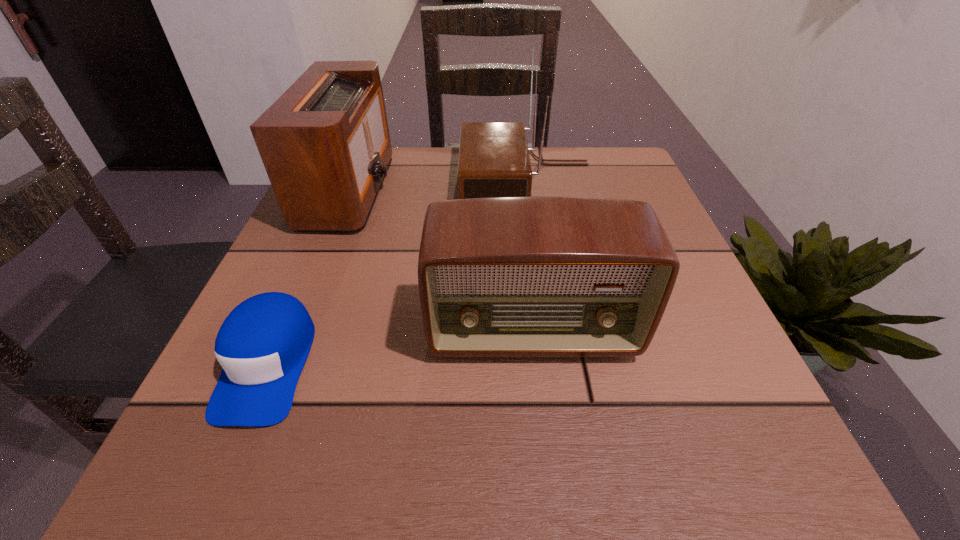
Locate an element on the screen. The image size is (960, 540). the leftmost radio receiver is located at coordinates (325, 144).

I want to click on the nearest radio receiver, so click(502, 276).

At what (x,y) coordinates should I click in order to perform the action: click on the shortest object. Please return your answer as a coordinate pair (x, y). This screenshot has width=960, height=540. Looking at the image, I should click on (262, 345).

You are a GUI agent. You are given a task and a screenshot of the screen. Output one action in this format:
    pyautogui.click(x=<x>, y=<y>)
    Task: Click on the vacant space located on the right of the leftmost radio receiver
    Image resolution: width=960 pixels, height=540 pixels.
    Given the screenshot: What is the action you would take?
    pyautogui.click(x=525, y=190)

The image size is (960, 540). In order to click on free space located 0.090m on the front-facing side of the nearest radio receiver in this screenshot , I will do `click(542, 423)`.

The image size is (960, 540). I want to click on vacant space located 0.060m on the front-facing side of the shortest object, so (220, 477).

At what (x,y) coordinates should I click in order to perform the action: click on object that is at the near edge. Please return your answer as a coordinate pair (x, y). The height and width of the screenshot is (540, 960). Looking at the image, I should click on (262, 345).

The width and height of the screenshot is (960, 540). I want to click on radio receiver located in the left edge section of the desktop, so click(325, 144).

Find the location of a particular element. This screenshot has width=960, height=540. baseball cap at the left edge is located at coordinates (262, 345).

The height and width of the screenshot is (540, 960). I want to click on object located at the far left corner, so click(x=325, y=144).